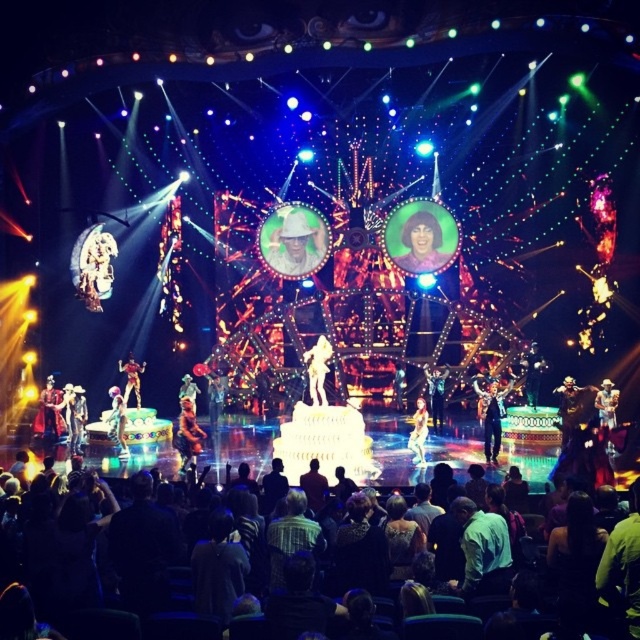
You are a stagehand responsible for setting up the next act. You need to place a 1.2 meter tall prop behind both the shiny gold helmet at right and the pastel pink fabric at center. Which object will require the prop to be placed further back to avoid blocking the view?

The shiny gold helmet at right is taller than the pastel pink fabric at center. Since the prop needs to be placed behind both, it should be positioned further back relative to the shiny gold helmet at right to ensure it doesn not block the view of the taller object.

You are a stagehand responsible for ensuring the performers have enough space to move around. You notice the shiny gold suit at center and the metallic gold statue at center. Based on their widths, which one might require more space to maneuver around?

The shiny gold suit at center might require more space to maneuver around since it might be wider than the metallic gold statue at center according to the description.